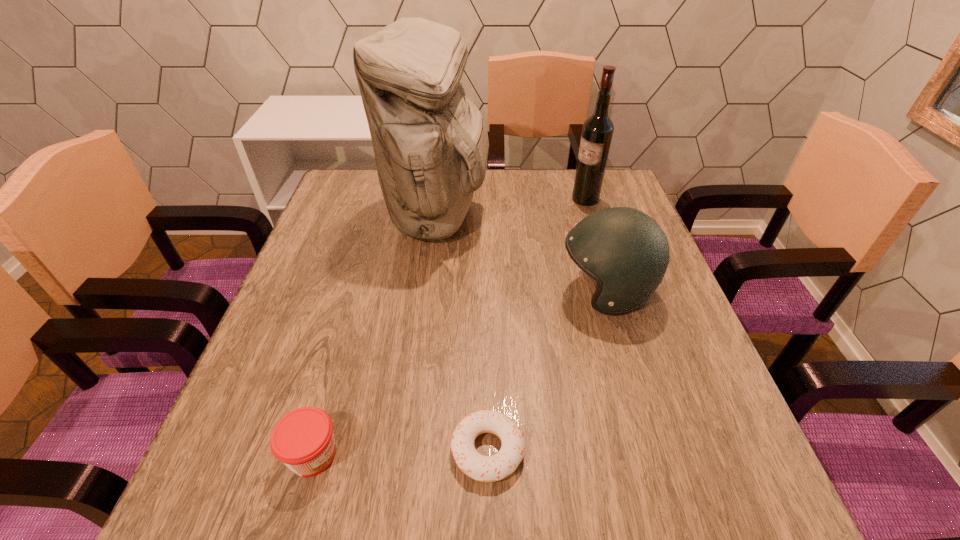
Identify the location of the tallest object. This screenshot has width=960, height=540. (430, 141).

Find the location of a particular element. The height and width of the screenshot is (540, 960). wine bottle is located at coordinates (597, 132).

I want to click on football helmet, so click(626, 252).

The image size is (960, 540). Identify the location of the second shortest object. (303, 439).

Where is `doughnut`? Image resolution: width=960 pixels, height=540 pixels. doughnut is located at coordinates (482, 468).

Locate an element on the screen. The height and width of the screenshot is (540, 960). blank space located on the front-facing side of the tallest object is located at coordinates (612, 215).

Locate an element on the screen. vacant space located on the front and back of the wine bottle is located at coordinates (502, 199).

The height and width of the screenshot is (540, 960). Identify the location of free spot located on the front and back of the wine bottle. (468, 199).

This screenshot has width=960, height=540. What are the coordinates of `free region located on the front and back of the wine bottle` in the screenshot? It's located at (468, 199).

Where is `vacant space located at the face opening of the football helmet`? The height and width of the screenshot is (540, 960). vacant space located at the face opening of the football helmet is located at coordinates (444, 291).